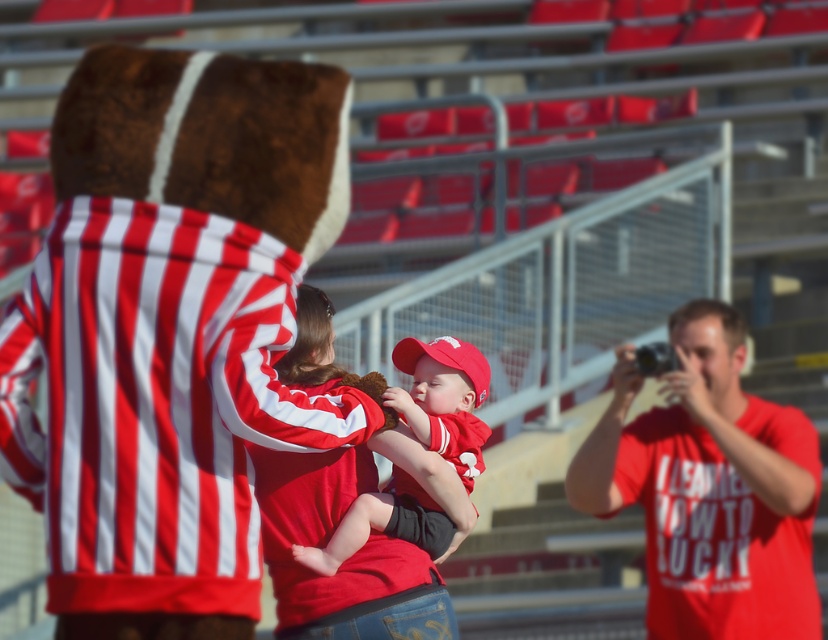
You are standing at the back of the stadium and want to approach the two points in the image. Which point should you reach first, point (x=652, y=634) or point (x=446, y=412)?

Point (x=652, y=634) is closer to the viewer, so you will reach it first.